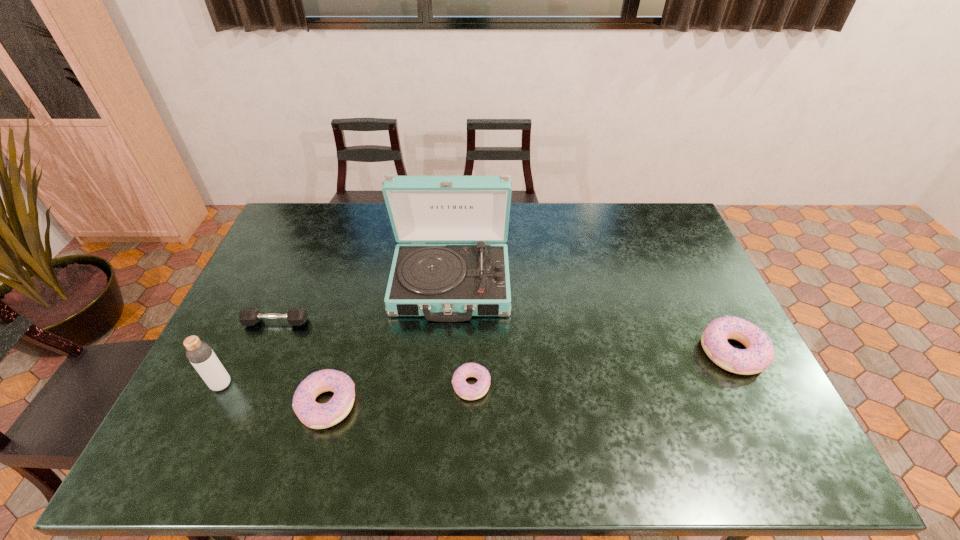
The height and width of the screenshot is (540, 960). Identify the location of blank region between the record player and the dumbbell. (364, 303).

This screenshot has width=960, height=540. Find the location of `unoccupied area between the shortest doughnut and the tallest object`. unoccupied area between the shortest doughnut and the tallest object is located at coordinates coord(461,334).

Find the location of a particular element. The width and height of the screenshot is (960, 540). free spot between the shortest doughnut and the tallest object is located at coordinates (461, 334).

Find the location of a particular element. This screenshot has width=960, height=540. unoccupied position between the record player and the dumbbell is located at coordinates (364, 303).

Point out which object is positioned as the fourth nearest to the tallest object. Please provide its 2D coordinates. Your answer should be formatted as a tuple, i.e. [(x, y)], where the tuple contains the x and y coordinates of a point satisfying the conditions above.

[(199, 353)]

In order to click on object that is the closest to the bottle in this screenshot , I will do `click(249, 316)`.

The width and height of the screenshot is (960, 540). I want to click on the second closest doughnut relative to the second doughnut from left to right, so click(760, 353).

Where is `doughnut that stands as the closest to the second doughnut from right to left`? This screenshot has height=540, width=960. doughnut that stands as the closest to the second doughnut from right to left is located at coordinates (314, 415).